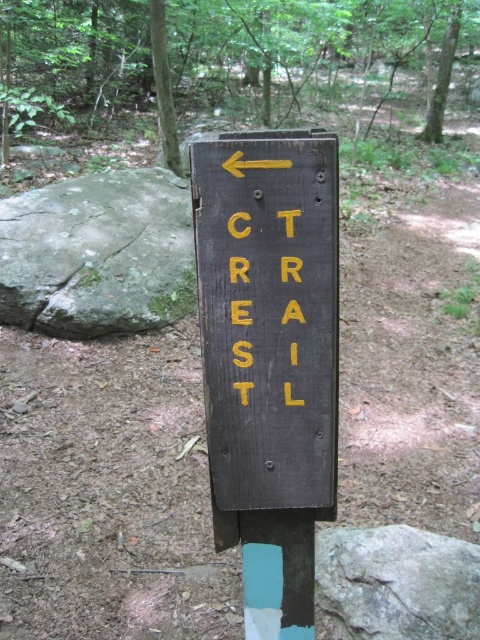
Question: Is matte wood sign at center positioned behind yellow painted letters at center?

Choices:
 (A) yes
 (B) no

Answer: (B)

Question: Which point appears farthest from the camera in this image?

Choices:
 (A) (412, 579)
 (B) (333, 396)
 (C) (165, 216)

Answer: (C)

Question: Is matte wood sign at center behind green rough rock at left?

Choices:
 (A) no
 (B) yes

Answer: (A)

Question: Is matte wood sign at center behind gray rough rock at center?

Choices:
 (A) no
 (B) yes

Answer: (A)

Question: Among these points, which one is farthest from the camera?

Choices:
 (A) (59, 269)
 (B) (228, 218)
 (C) (332, 513)

Answer: (A)

Question: Which point is farther to the camera?

Choices:
 (A) green rough rock at left
 (B) yellow painted letters at center
 (C) matte wood sign at center
 (D) gray rough rock at center

Answer: (A)